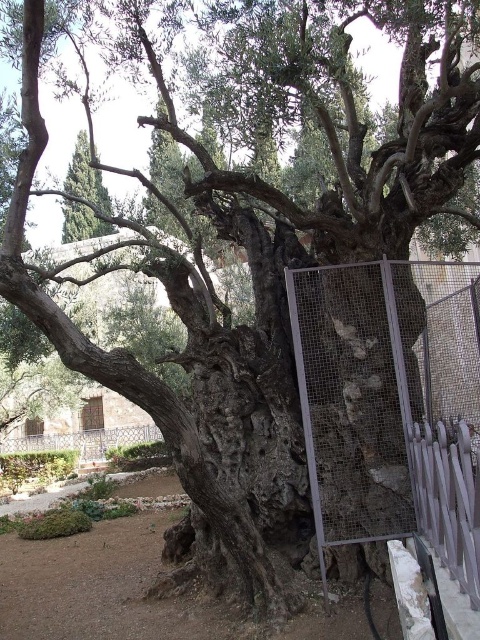
Question: Which point is closer to the camera?

Choices:
 (A) green rough textured tree at upper left
 (B) metal mesh fence at center
 (C) white metal fence at right
 (D) wrought iron fence at lower left

Answer: (C)

Question: From the image, what is the correct spatial relationship of metal mesh fence at center in relation to white metal fence at right?

Choices:
 (A) above
 (B) below

Answer: (A)

Question: Does metal mesh fence at center lie behind white metal fence at right?

Choices:
 (A) no
 (B) yes

Answer: (B)

Question: Which object appears closest to the camera in this image?

Choices:
 (A) metal mesh fence at center
 (B) wrought iron fence at lower left
 (C) green rough textured tree at upper left
 (D) white metal fence at right

Answer: (D)

Question: Which of the following is the closest to the observer?

Choices:
 (A) metal mesh fence at center
 (B) green rough textured tree at upper left

Answer: (A)

Question: Is metal mesh fence at center below green rough textured tree at upper left?

Choices:
 (A) no
 (B) yes

Answer: (B)